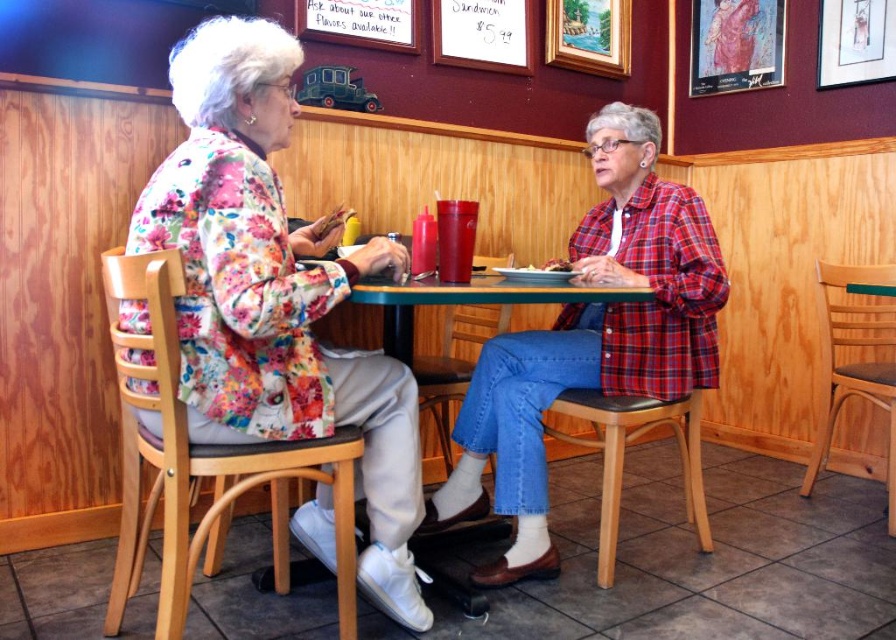
Which is below, floral fabric jacket at upper left or wooden stool at lower center?

wooden stool at lower center is lower down.

Can you confirm if floral fabric jacket at upper left is positioned to the left of wooden stool at lower center?

Indeed, floral fabric jacket at upper left is positioned on the left side of wooden stool at lower center.

Does point (290, 400) come behind point (595, 404)?

No, it is in front of (595, 404).

The width and height of the screenshot is (896, 640). What are the coordinates of `floral fabric jacket at upper left` in the screenshot? It's located at (277, 292).

Is point (526, 524) less distant than point (695, 476)?

Yes.

The width and height of the screenshot is (896, 640). What are the coordinates of `plaid shirt at center` in the screenshot? It's located at (590, 339).

Does point (604, 269) come behind point (599, 540)?

No, (604, 269) is in front of (599, 540).

At what (x,y) coordinates should I click in order to perform the action: click on plaid shirt at center. Please return your answer as a coordinate pair (x, y). Image resolution: width=896 pixels, height=640 pixels. Looking at the image, I should click on (590, 339).

Between floral fabric jacket at upper left and wooden picture frame at upper right, which one appears on the left side from the viewer's perspective?

floral fabric jacket at upper left

Consider the image. Does floral fabric jacket at upper left appear on the right side of wooden picture frame at upper right?

No, floral fabric jacket at upper left is not to the right of wooden picture frame at upper right.

What are the coordinates of `floral fabric jacket at upper left` in the screenshot? It's located at click(x=277, y=292).

The width and height of the screenshot is (896, 640). Identify the location of floral fabric jacket at upper left. (277, 292).